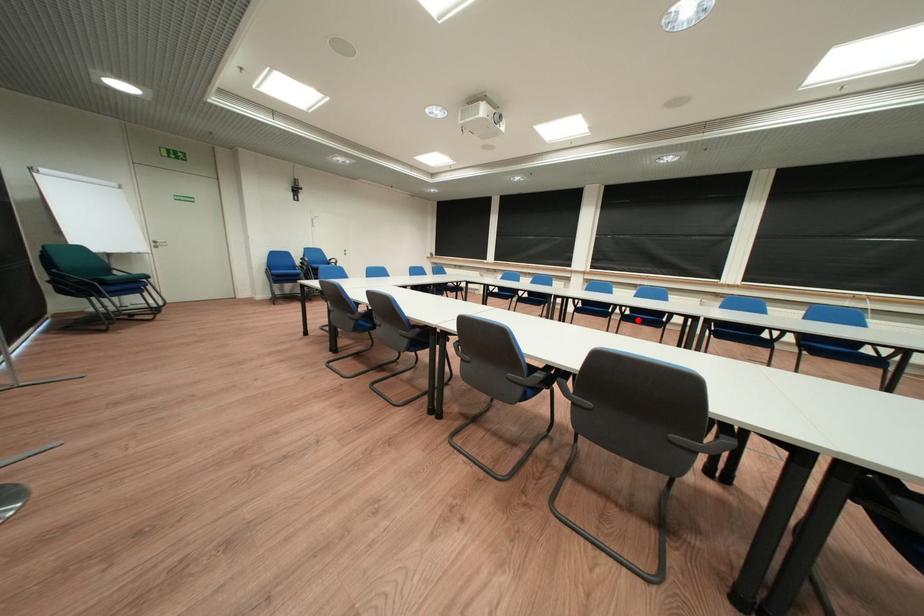
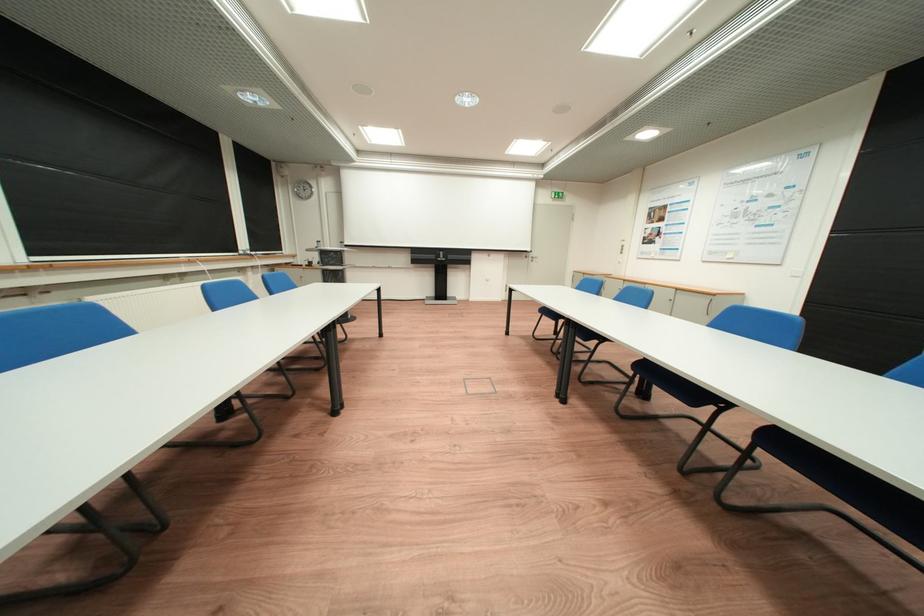
Question: I am providing you with two images of the same scene from different viewpoints. A red point is marked on the first image. Is the red point's position out of view in image 2?

Choices:
 (A) Yes
 (B) No

Answer: (A)